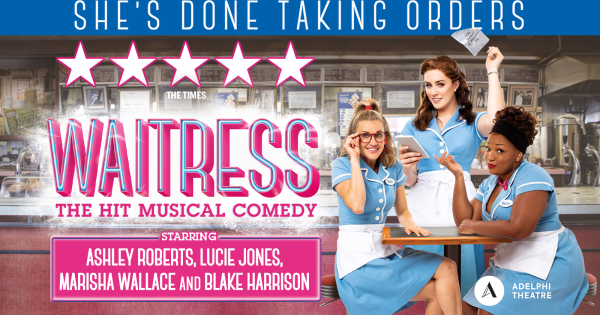
Where is `stove exhaust vent`? The width and height of the screenshot is (600, 315). stove exhaust vent is located at coordinates (570, 78).